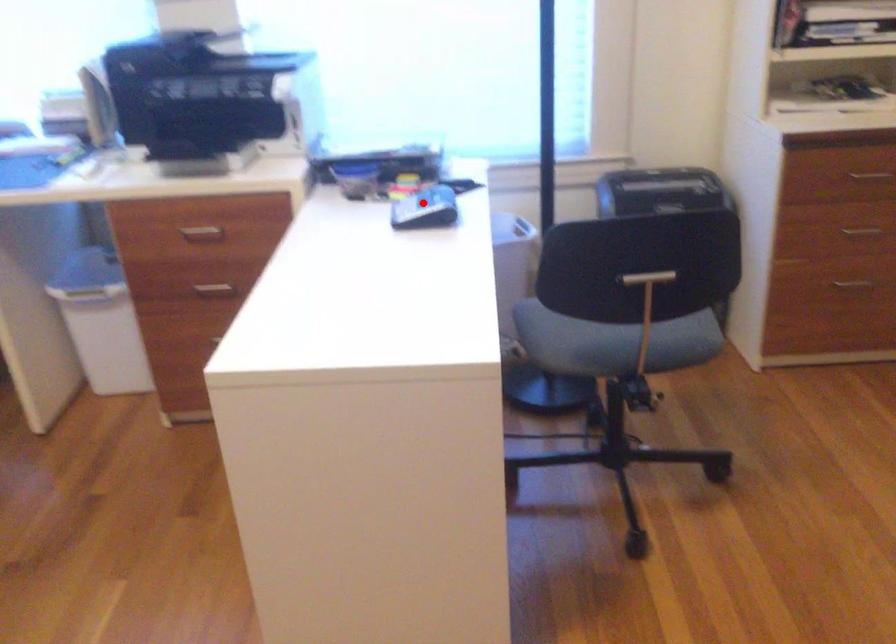
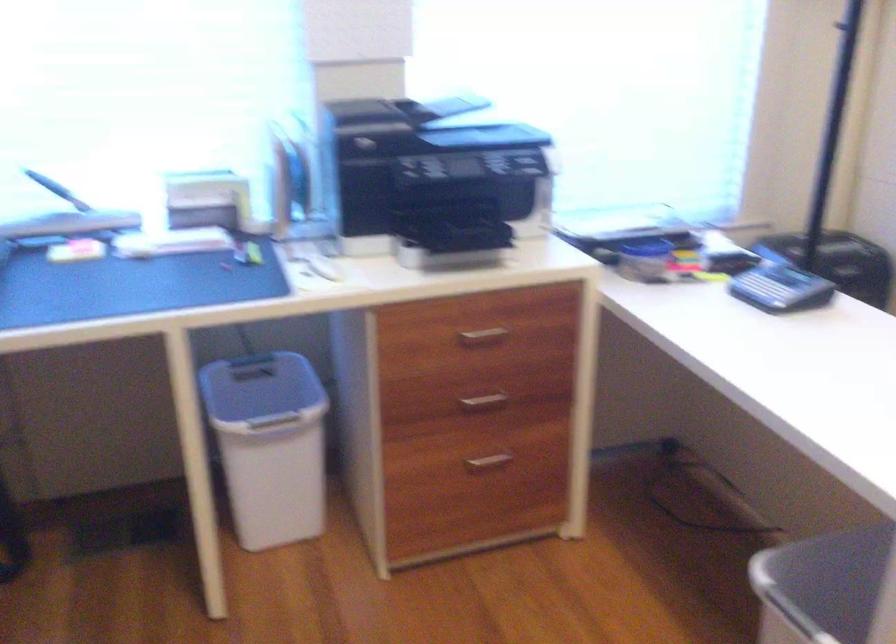
Locate, in the second image, the point that corresponds to the highlighted location in the first image.

(780, 288)